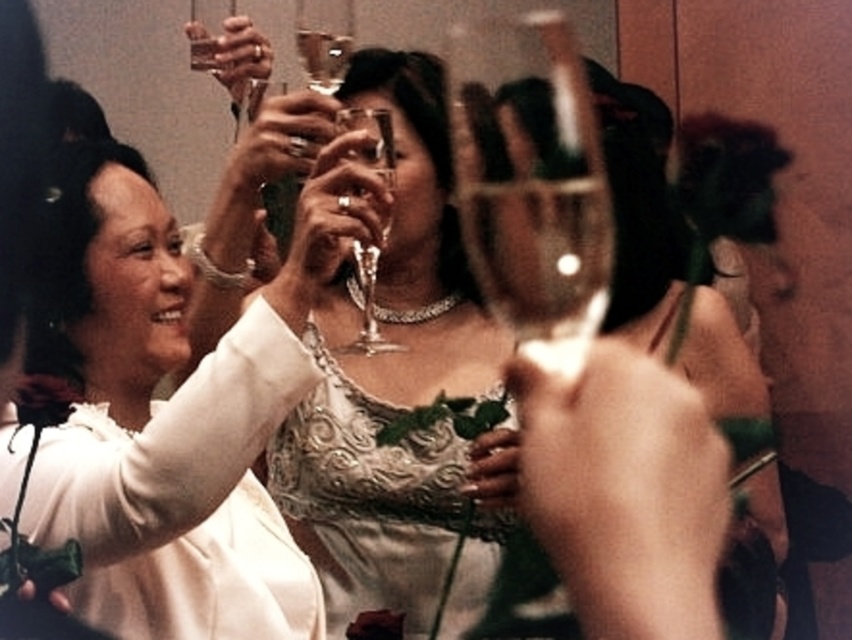
Is point (484, 77) farther from camera compared to point (381, 136)?

Yes, it is behind point (381, 136).

Between point (537, 248) and point (396, 348), which one is positioned behind?

Positioned behind is point (537, 248).

This screenshot has width=852, height=640. In order to click on transparent glass wine glass at center in this screenshot , I will do `click(531, 182)`.

The height and width of the screenshot is (640, 852). What do you see at coordinates (531, 182) in the screenshot? I see `transparent glass wine glass at center` at bounding box center [531, 182].

Which of these two, transparent glass wine glass at center or satin lace dress at center, stands taller?

With more height is transparent glass wine glass at center.

Is point (602, 304) positioned in front of point (488, 394)?

No, (602, 304) is behind (488, 394).

Where is `transparent glass wine glass at center`? transparent glass wine glass at center is located at coordinates (531, 182).

Which of these two, clear glass wine glass at center or clear glass wine glass at upper center, stands shorter?

With less height is clear glass wine glass at upper center.

Is point (367, 115) less distant than point (327, 36)?

No, it is behind (327, 36).

Where is `clear glass wine glass at center`? This screenshot has width=852, height=640. clear glass wine glass at center is located at coordinates (370, 138).